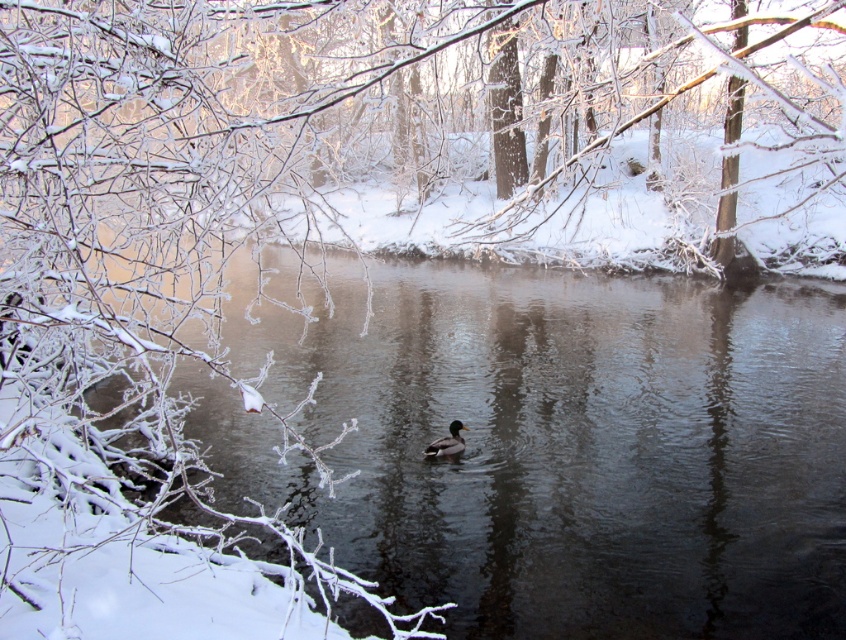
You are standing at the edge of the water in the winter scene. If you want to throw a pebble into the clear water at center, where should you aim? Please provide the coordinates in the format of a point like this example format of point coordinates in the image, for instance, point 0.5, 0.5.

The clear water at center is located at point (x=553, y=444), so you should aim for that coordinate to hit the clear water at center.